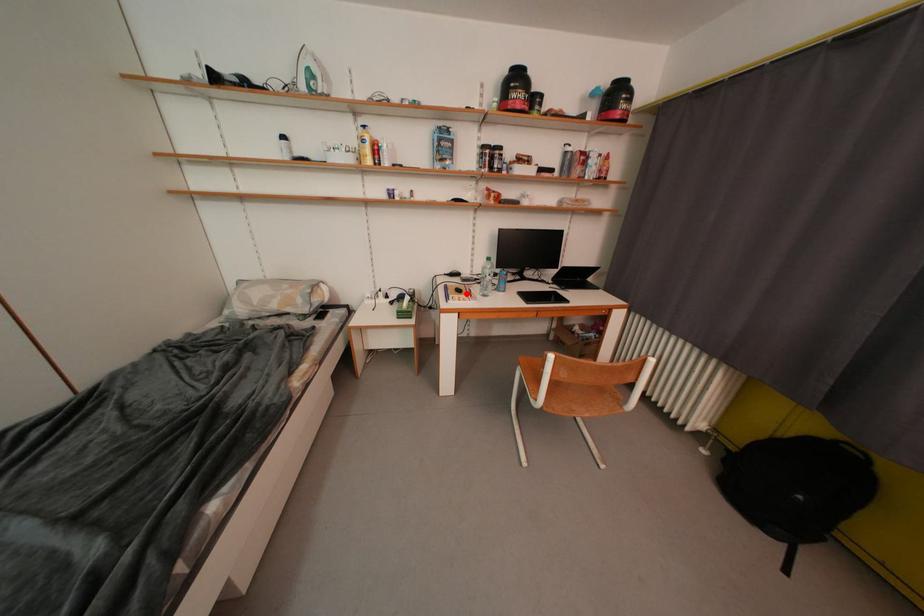
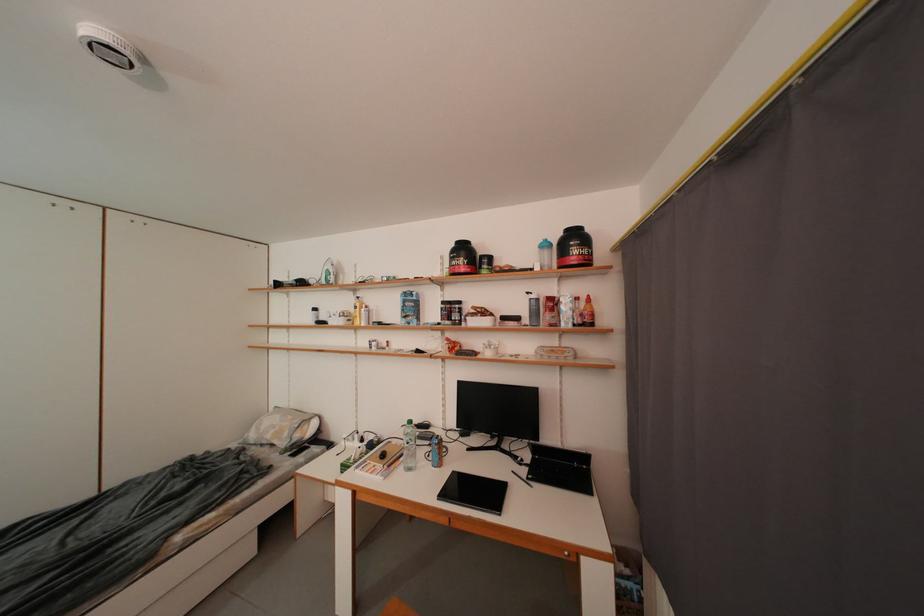
Question: I am providing you with two images of the same scene from different viewpoints. A red point is shown in image1. For the corresponding object point in image2, is it positioned nearer or farther from the camera?

Choices:
 (A) Nearer
 (B) Farther

Answer: (B)